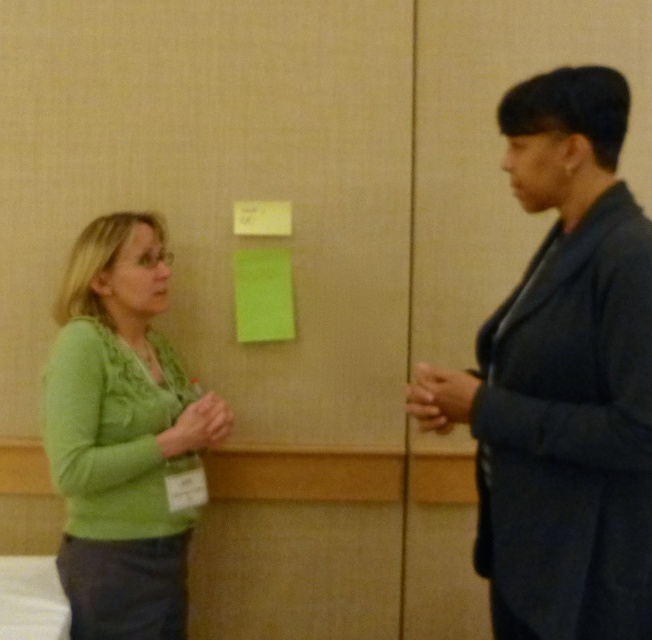
Is dark blue suit at right below green soft sweater at left?

No, dark blue suit at right is not below green soft sweater at left.

Can you confirm if dark blue suit at right is positioned above green soft sweater at left?

Yes, dark blue suit at right is above green soft sweater at left.

Is point (501, 120) less distant than point (228, 410)?

Yes, it is.

Where is `dark blue suit at right`? dark blue suit at right is located at coordinates (561, 380).